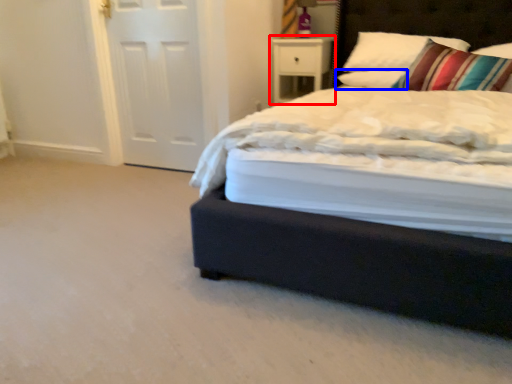
Question: Which object is further to the camera taking this photo, nightstand (highlighted by a red box) or pillow (highlighted by a blue box)?

Choices:
 (A) nightstand
 (B) pillow

Answer: (A)